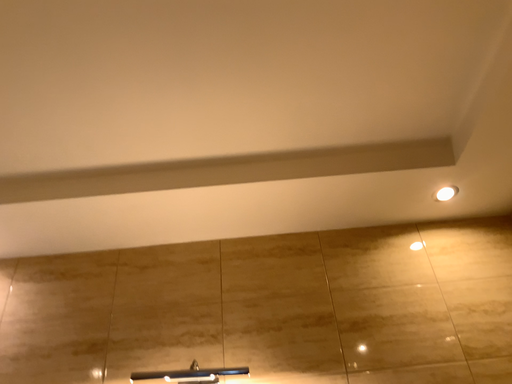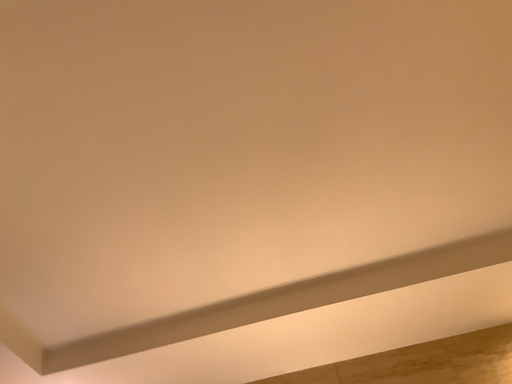
Question: How did the camera likely rotate when shooting the video?

Choices:
 (A) rotated right
 (B) rotated left

Answer: (B)